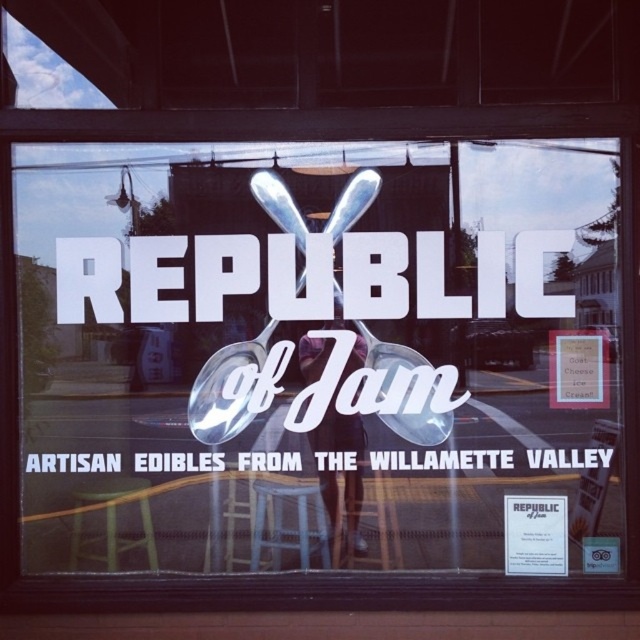
Based on the scene description, where is the matte glass sign at center located in the window display?

The matte glass sign at center is located at point (307, 355) in the window display.

You are a customer entering the store and see the yellow plastic stool at lower left and the blue fabric stool at lower center. Which stool is taller?

The yellow plastic stool at lower left is much taller than the blue fabric stool at lower center.